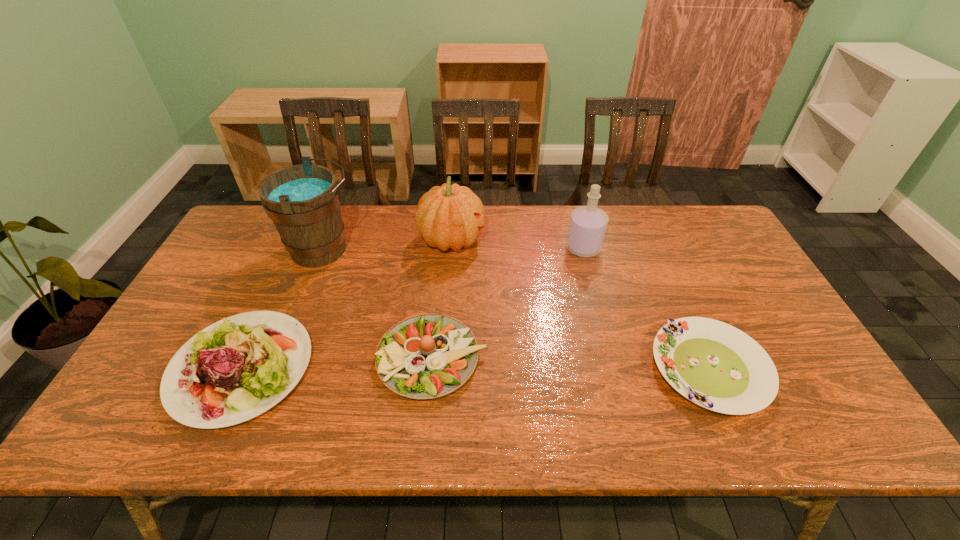
At what (x,y) coordinates should I click in order to perform the action: click on vacant area in the image that satisfies the following two spatial constraints: 1. on the carved face of the perfume; 2. on the right side of the pumpkin. Please return your answer as a coordinate pair (x, y). Looking at the image, I should click on (451, 248).

Image resolution: width=960 pixels, height=540 pixels. I want to click on vacant area in the image that satisfies the following two spatial constraints: 1. with a handle on the side of the wine bucket; 2. on the right side of the second salad plate from left to right, so click(280, 359).

The width and height of the screenshot is (960, 540). What are the coordinates of `free space that satisfies the following two spatial constraints: 1. on the back side of the perfume; 2. on the right side of the leftmost salad plate` in the screenshot? It's located at (297, 248).

This screenshot has width=960, height=540. I want to click on vacant space that satisfies the following two spatial constraints: 1. with a handle on the side of the shortest salad plate; 2. on the left side of the wine bucket, so click(276, 368).

In order to click on free point that satisfies the following two spatial constraints: 1. with a handle on the side of the wine bucket; 2. on the left side of the second salad plate from left to right in this screenshot , I will do `click(280, 359)`.

Find the location of a particular element. blank area in the image that satisfies the following two spatial constraints: 1. on the carved face of the pumpkin; 2. on the right side of the perfume is located at coordinates (451, 248).